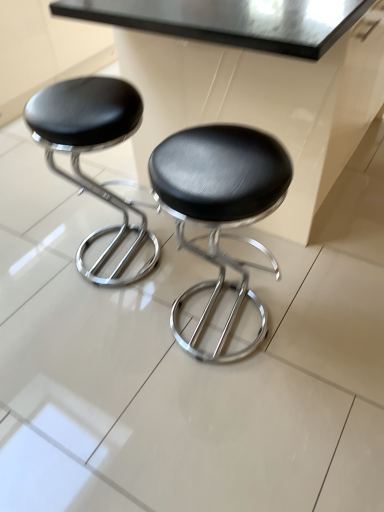
Identify the location of free spot above black leather stool at center, the second stool when ordered from left to right (from a real-world perspective). (232, 173).